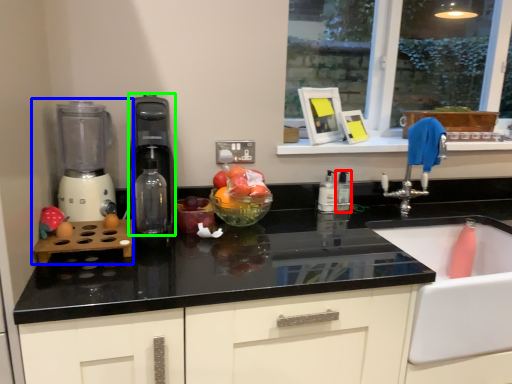
Question: Which object is the farthest from bottle (highlighted by a red box)? Choose among these: mixer (highlighted by a blue box) or kitchen appliance (highlighted by a green box).

Choices:
 (A) mixer
 (B) kitchen appliance

Answer: (A)